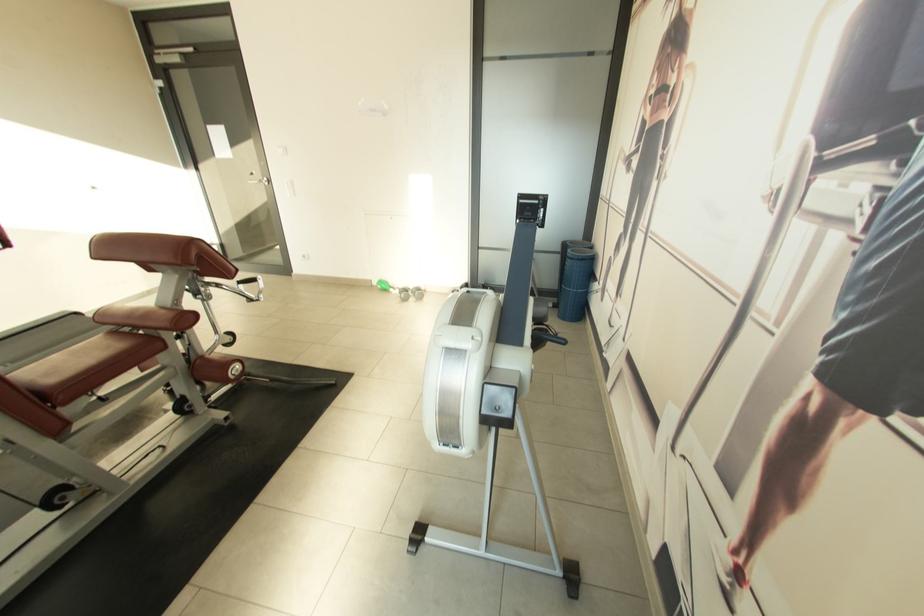
Find the location of `rowing machine handle`. rowing machine handle is located at coordinates (544, 339).